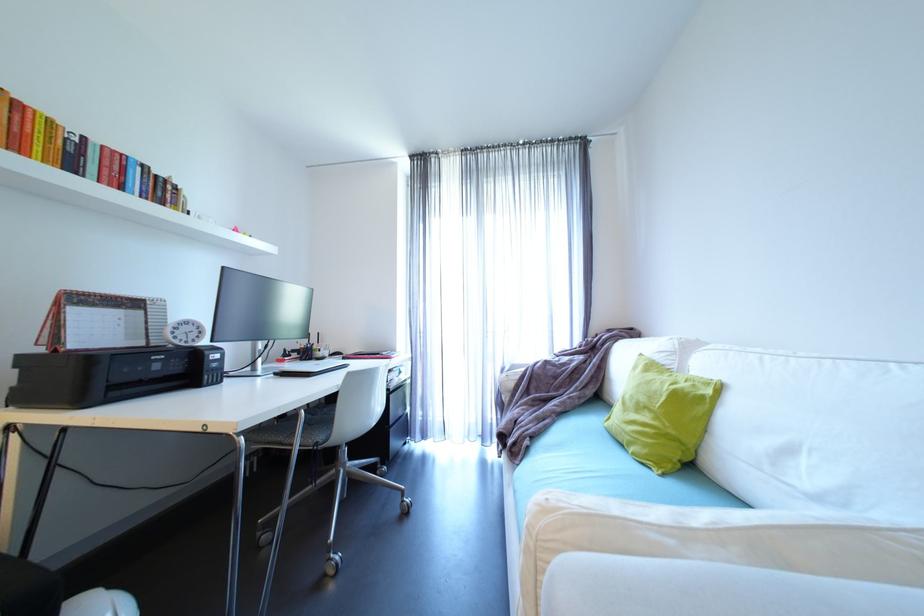
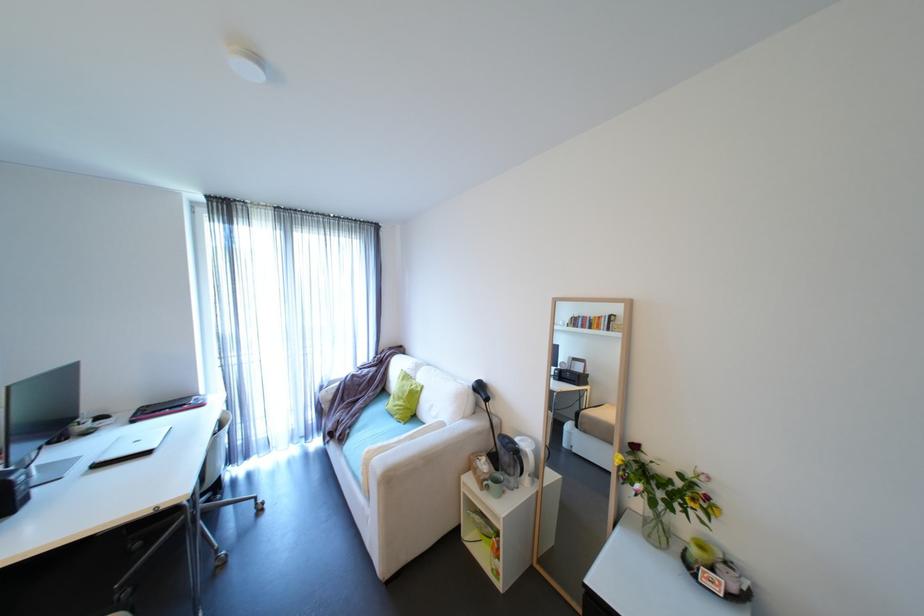
Find the pixel in the second image that matches point (521, 450) in the first image.

(347, 438)